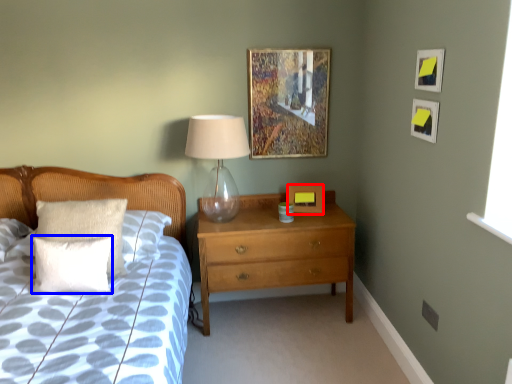
Question: Which point is further to the camera, picture frame (highlighted by a red box) or pillow (highlighted by a blue box)?

Choices:
 (A) picture frame
 (B) pillow

Answer: (A)